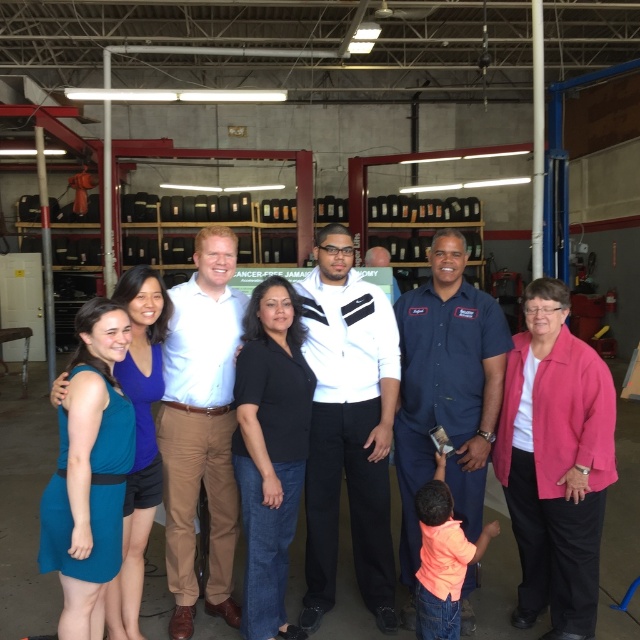
You are standing at the entrance of the warehouse and want to locate the person wearing the blue uniform shirt at center. According to the coordinates provided, where should you look to find them?

The blue uniform shirt at center is located at coordinates point (x=445, y=388).

In the scene shown: You are standing at the entrance of the warehouse and see the white smooth jacket at center. Can you estimate how far it is from the entrance?

The white smooth jacket at center is located at point 0.670 on the horizontal axis and 0.545 on the vertical axis, so it is approximately 67.0 centimeters horizontally and 54.5 centimeters vertically from the entrance.

You are organizing a photo shoot in this warehouse scene and need to place a small prop on the white smooth jacket at center and a larger prop on the blue uniform shirt at center. Based on their sizes, which object should the larger prop be placed on?

The blue uniform shirt at center is larger than the white smooth jacket at center, so the larger prop should be placed on the blue uniform shirt at center.